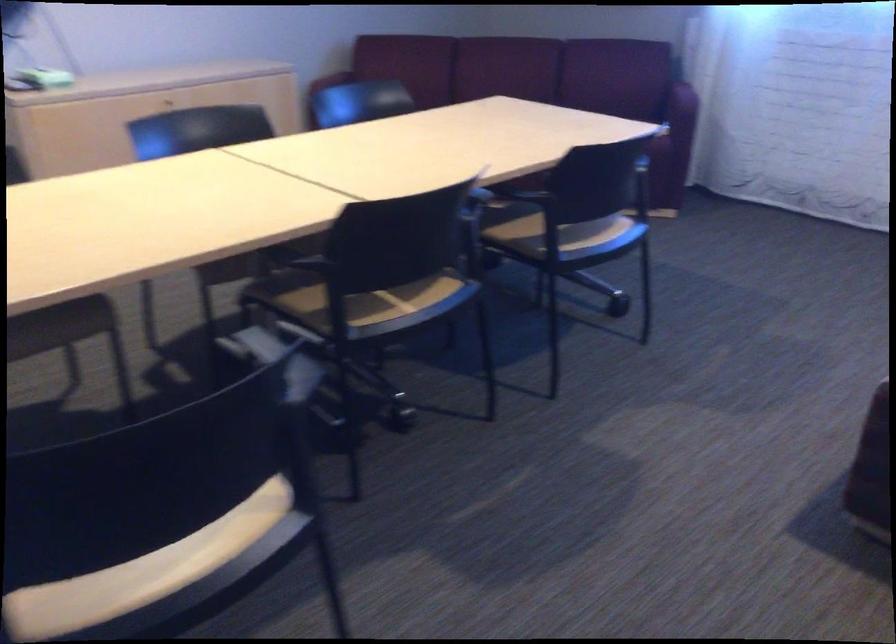
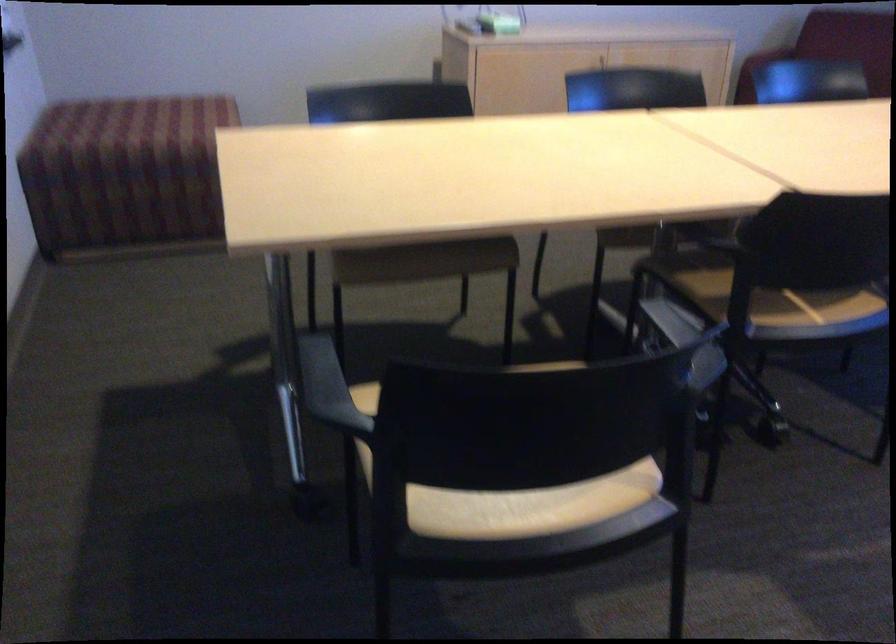
Find the pixel in the second image that matches point 150,564 in the first image.

(515, 509)